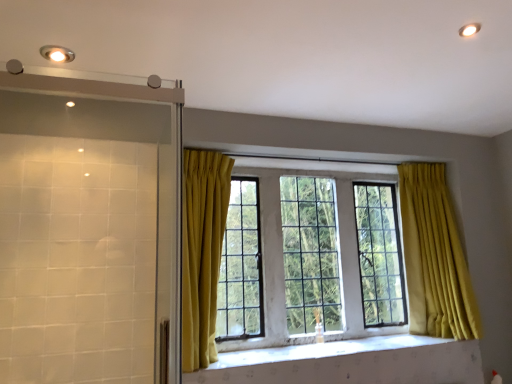
Identify the location of vacant area that is in front of matte silver light fixture at upper left. The height and width of the screenshot is (384, 512). (42, 30).